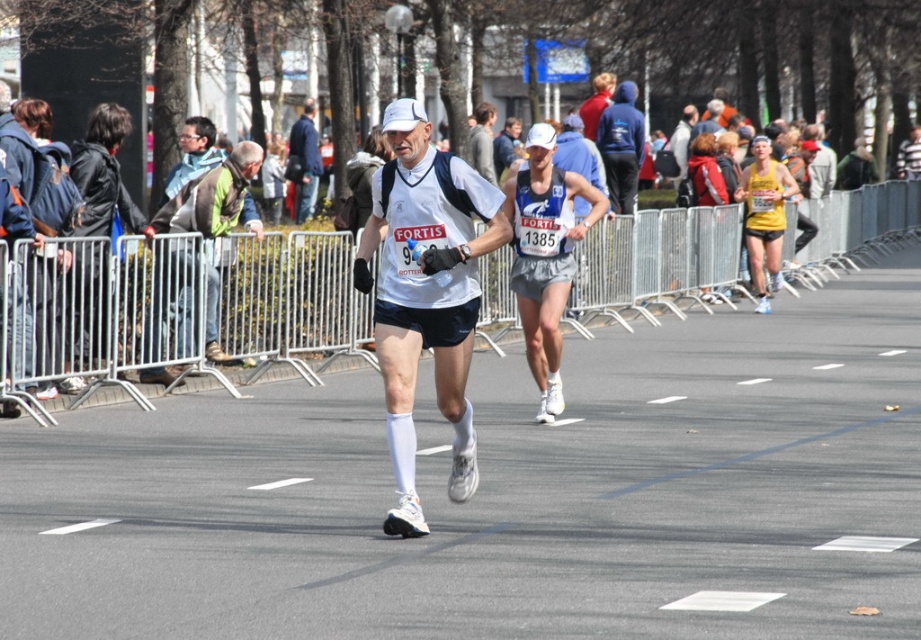
Based on the photo, is matte blue scarf at upper left positioned before matte white tank top at center?

Yes.

Between matte blue scarf at upper left and matte white tank top at center, which one has less height?

matte white tank top at center is shorter.

Between point (184, 132) and point (710, 122), which one is positioned in front?

Point (184, 132) is in front.

Image resolution: width=921 pixels, height=640 pixels. I want to click on matte blue scarf at upper left, so [193, 154].

Who is positioned more to the left, green fabric jacket at left or matte white tank top at center?

green fabric jacket at left is more to the left.

Is green fabric jacket at left in front of matte white tank top at center?

Yes, it is.

You are a GUI agent. You are given a task and a screenshot of the screen. Output one action in this format:
    pyautogui.click(x=<x>, y=<y>)
    Task: Click on the green fabric jacket at left
    
    Given the screenshot: What is the action you would take?
    pyautogui.click(x=214, y=198)

I want to click on green fabric jacket at left, so [x=214, y=198].

Can you confirm if light brown leather jacket at upper center is smaller than red jacket at center?

Correct, light brown leather jacket at upper center occupies less space than red jacket at center.

This screenshot has width=921, height=640. What do you see at coordinates (304, 163) in the screenshot?
I see `light brown leather jacket at upper center` at bounding box center [304, 163].

The image size is (921, 640). What do you see at coordinates (304, 163) in the screenshot? I see `light brown leather jacket at upper center` at bounding box center [304, 163].

Find the location of a particular element. light brown leather jacket at upper center is located at coordinates tap(304, 163).